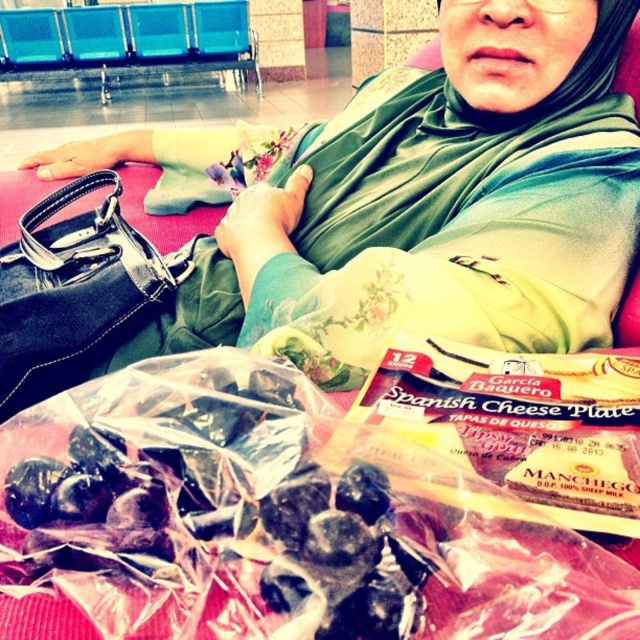
Question: Is green fabric scarf at upper center thinner than black leather handbag at left?

Choices:
 (A) no
 (B) yes

Answer: (A)

Question: Can you confirm if green fabric scarf at upper center is thinner than black leather handbag at left?

Choices:
 (A) yes
 (B) no

Answer: (B)

Question: Can you confirm if green fabric scarf at upper center is smaller than black leather handbag at left?

Choices:
 (A) no
 (B) yes

Answer: (A)

Question: Which point is farther from the camera taking this photo?

Choices:
 (A) (456, 253)
 (B) (170, 269)

Answer: (B)